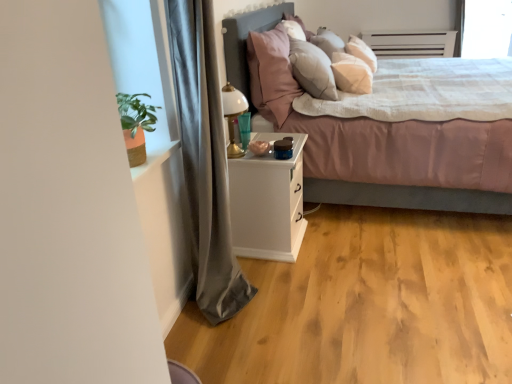
Question: Is white matte nightstand at center further to camera compared to transparent glass window screen at upper right?

Choices:
 (A) no
 (B) yes

Answer: (A)

Question: Does white matte nightstand at center have a larger size compared to transparent glass window screen at upper right?

Choices:
 (A) no
 (B) yes

Answer: (B)

Question: Is white matte nightstand at center turned away from transparent glass window screen at upper right?

Choices:
 (A) yes
 (B) no

Answer: (B)

Question: Can we say white matte nightstand at center lies outside transparent glass window screen at upper right?

Choices:
 (A) no
 (B) yes

Answer: (B)

Question: Can you confirm if white matte nightstand at center is shorter than transparent glass window screen at upper right?

Choices:
 (A) no
 (B) yes

Answer: (B)

Question: From a real-world perspective, is pink plush pillow at upper center positioned above or below gray fabric curtain at left?

Choices:
 (A) below
 (B) above

Answer: (B)

Question: Relative to gray fabric curtain at left, is pink plush pillow at upper center in front or behind?

Choices:
 (A) front
 (B) behind

Answer: (B)

Question: Choose the correct answer: Is pink plush pillow at upper center inside gray fabric curtain at left or outside it?

Choices:
 (A) inside
 (B) outside

Answer: (B)

Question: In the image, is pink plush pillow at upper center on the left side or the right side of gray fabric curtain at left?

Choices:
 (A) right
 (B) left

Answer: (A)

Question: In terms of height, does gray fabric curtain at left look taller or shorter compared to white matte nightstand at center?

Choices:
 (A) short
 (B) tall

Answer: (B)

Question: Based on their sizes in the image, would you say gray fabric curtain at left is bigger or smaller than white matte nightstand at center?

Choices:
 (A) big
 (B) small

Answer: (A)

Question: Is gray fabric curtain at left wider or thinner than white matte nightstand at center?

Choices:
 (A) thin
 (B) wide

Answer: (A)

Question: Visually, is gray fabric curtain at left positioned to the left or to the right of white matte nightstand at center?

Choices:
 (A) right
 (B) left

Answer: (B)

Question: Considering the positions of gray fabric curtain at left and pink plush pillow at upper center in the image, is gray fabric curtain at left taller or shorter than pink plush pillow at upper center?

Choices:
 (A) tall
 (B) short

Answer: (A)

Question: From a real-world perspective, is gray fabric curtain at left above or below pink plush pillow at upper center?

Choices:
 (A) above
 (B) below

Answer: (B)